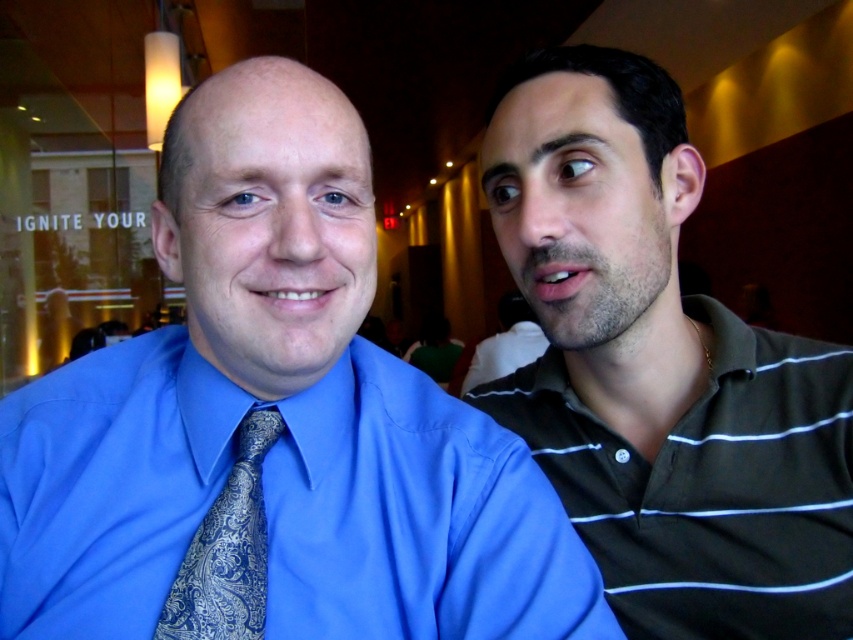
Question: Is blue satin shirt at center in front of blue paisley tie at center?

Choices:
 (A) no
 (B) yes

Answer: (B)

Question: Where is blue satin shirt at center located in relation to blue paisley tie at center in the image?

Choices:
 (A) below
 (B) above

Answer: (B)

Question: Among these points, which one is farthest from the camera?

Choices:
 (A) (494, 348)
 (B) (550, 90)

Answer: (A)

Question: Is green striped polo shirt at right below striped jersey shirt at right?

Choices:
 (A) yes
 (B) no

Answer: (B)

Question: Which object is the farthest from the green striped polo shirt at right?

Choices:
 (A) striped jersey shirt at right
 (B) blue paisley tie at center
 (C) blue satin shirt at center

Answer: (A)

Question: Estimate the real-world distances between objects in this image. Which object is farther from the blue paisley tie at center?

Choices:
 (A) striped jersey shirt at right
 (B) blue satin shirt at center
 (C) green striped polo shirt at right

Answer: (A)